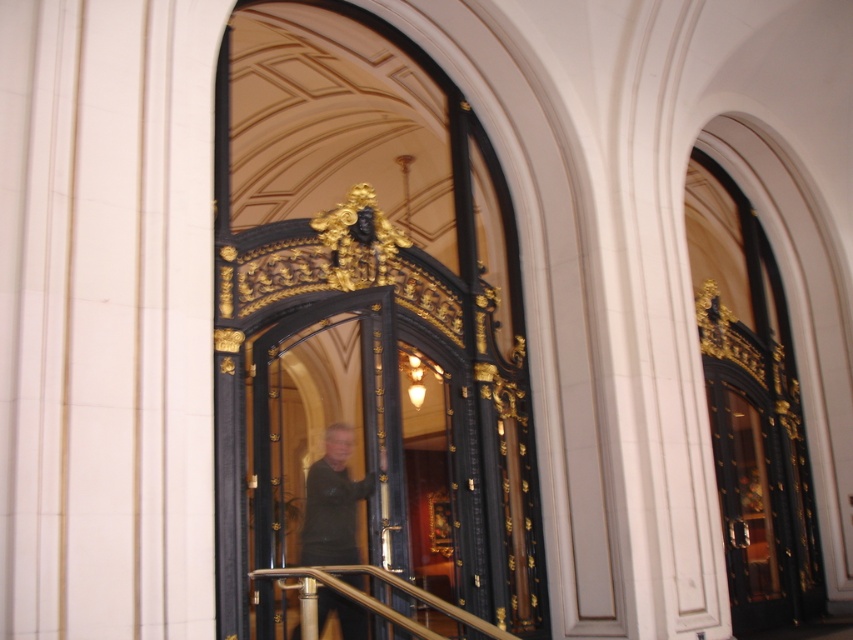
You are a delivery person with a cart that is 1.8 meters wide. You need to move your cart through the entrance where the polished dark wood door at center is partially open. Can your cart fit through the space between the door and the polished brass railing at center?

The distance between the polished dark wood door at center and the polished brass railing at center is 2.54 meters. Since your cart is 1.8 meters wide, it can fit through the space as the available width is greater than the cart width.

You are standing at the entrance of the grand door and want to reach the polished brass railing at center without getting too close to the dark green fabric jacket at center. What is the minimum distance you need to walk to avoid the jacket?

The dark green fabric jacket at center is 3.59 feet away from the polished brass railing at center. To avoid getting too close to the jacket, you need to walk at least 3.6 feet away from the jacket towards the railing.

You are standing in front of the entrance and want to locate the polished dark wood door at center. What are the coordinates of the door?

The coordinates of the polished dark wood door at center are at point [358,449].